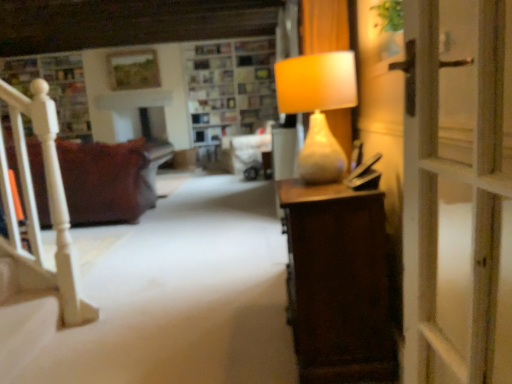
Question: Should I look upward or downward to see matte beige lamp at right?

Choices:
 (A) up
 (B) down

Answer: (A)

Question: Should I look upward or downward to see brown fabric couch at left?

Choices:
 (A) up
 (B) down

Answer: (A)

Question: Is wooden shelves at upper center completely or partially outside of matte beige lamp at right?

Choices:
 (A) yes
 (B) no

Answer: (A)

Question: Can you confirm if wooden shelves at upper center is bigger than matte beige lamp at right?

Choices:
 (A) yes
 (B) no

Answer: (A)

Question: Could you tell me if wooden shelves at upper center is turned towards matte beige lamp at right?

Choices:
 (A) no
 (B) yes

Answer: (B)

Question: From the image's perspective, would you say wooden shelves at upper center is shown under matte beige lamp at right?

Choices:
 (A) yes
 (B) no

Answer: (B)

Question: Is the position of wooden shelves at upper center more distant than that of matte beige lamp at right?

Choices:
 (A) no
 (B) yes

Answer: (B)

Question: Considering the relative sizes of wooden shelves at upper center and matte beige lamp at right in the image provided, is wooden shelves at upper center shorter than matte beige lamp at right?

Choices:
 (A) no
 (B) yes

Answer: (A)

Question: Is brown fabric couch at left bigger than wooden shelves at upper center?

Choices:
 (A) yes
 (B) no

Answer: (B)

Question: Can we say brown fabric couch at left lies outside wooden shelves at upper center?

Choices:
 (A) yes
 (B) no

Answer: (A)

Question: From the image's perspective, is brown fabric couch at left on wooden shelves at upper center?

Choices:
 (A) yes
 (B) no

Answer: (B)

Question: Can you confirm if brown fabric couch at left is positioned to the right of wooden shelves at upper center?

Choices:
 (A) no
 (B) yes

Answer: (A)

Question: Is brown fabric couch at left positioned behind wooden shelves at upper center?

Choices:
 (A) yes
 (B) no

Answer: (B)

Question: Is brown fabric couch at left to the left of wooden shelves at upper center from the viewer's perspective?

Choices:
 (A) yes
 (B) no

Answer: (A)

Question: Is brown fabric couch at left further to the viewer compared to matte beige lamp at right?

Choices:
 (A) no
 (B) yes

Answer: (B)